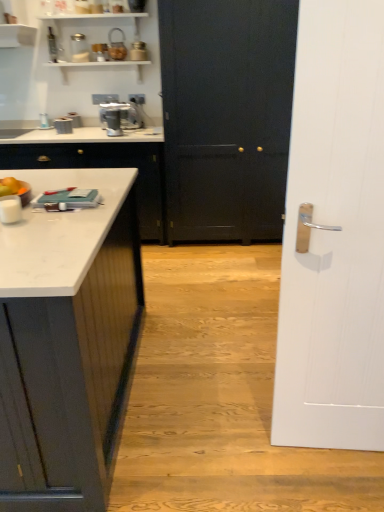
Question: Is white wood door at right, which appears as the 1th door when viewed from the front, further to the viewer compared to black matte door at center, which is the 2th door from front to back?

Choices:
 (A) no
 (B) yes

Answer: (A)

Question: Can you confirm if white wood door at right, which appears as the 1th door when viewed from the front, is bigger than black matte door at center, which ranks as the first door in back-to-front order?

Choices:
 (A) yes
 (B) no

Answer: (B)

Question: From a real-world perspective, is white wood door at right, acting as the 2th door starting from the back, physically above black matte door at center, which ranks as the first door in back-to-front order?

Choices:
 (A) yes
 (B) no

Answer: (B)

Question: Does white wood door at right, which appears as the 1th door when viewed from the front, have a greater height compared to black matte door at center, which is the 2th door from front to back?

Choices:
 (A) no
 (B) yes

Answer: (A)

Question: Is white wood door at right, acting as the 2th door starting from the back, not inside black matte door at center, which ranks as the first door in back-to-front order?

Choices:
 (A) no
 (B) yes

Answer: (B)

Question: From the image's perspective, relative to orange matte fruit at left, is metallic textured canister at upper center above or below?

Choices:
 (A) below
 (B) above

Answer: (B)

Question: Is point (117, 53) closer or farther from the camera than point (13, 187)?

Choices:
 (A) closer
 (B) farther

Answer: (B)

Question: Is metallic textured canister at upper center spatially inside orange matte fruit at left, or outside of it?

Choices:
 (A) inside
 (B) outside

Answer: (B)

Question: Would you say metallic textured canister at upper center is to the left or to the right of orange matte fruit at left in the picture?

Choices:
 (A) right
 (B) left

Answer: (A)

Question: In terms of height, does white marble countertop at left look taller or shorter compared to black matte door at center, which ranks as the first door in back-to-front order?

Choices:
 (A) tall
 (B) short

Answer: (B)

Question: From a real-world perspective, relative to black matte door at center, which ranks as the first door in back-to-front order, is white marble countertop at left vertically above or below?

Choices:
 (A) below
 (B) above

Answer: (A)

Question: Is white marble countertop at left in front of or behind black matte door at center, which is the 2th door from front to back, in the image?

Choices:
 (A) behind
 (B) front

Answer: (A)

Question: Would you say white marble countertop at left is to the left or to the right of black matte door at center, which is the 2th door from front to back, in the picture?

Choices:
 (A) right
 (B) left

Answer: (B)

Question: Considering the positions of orange matte fruit at left and white marble countertop at left in the image, is orange matte fruit at left bigger or smaller than white marble countertop at left?

Choices:
 (A) big
 (B) small

Answer: (B)

Question: From a real-world perspective, is orange matte fruit at left above or below white marble countertop at left?

Choices:
 (A) below
 (B) above

Answer: (B)